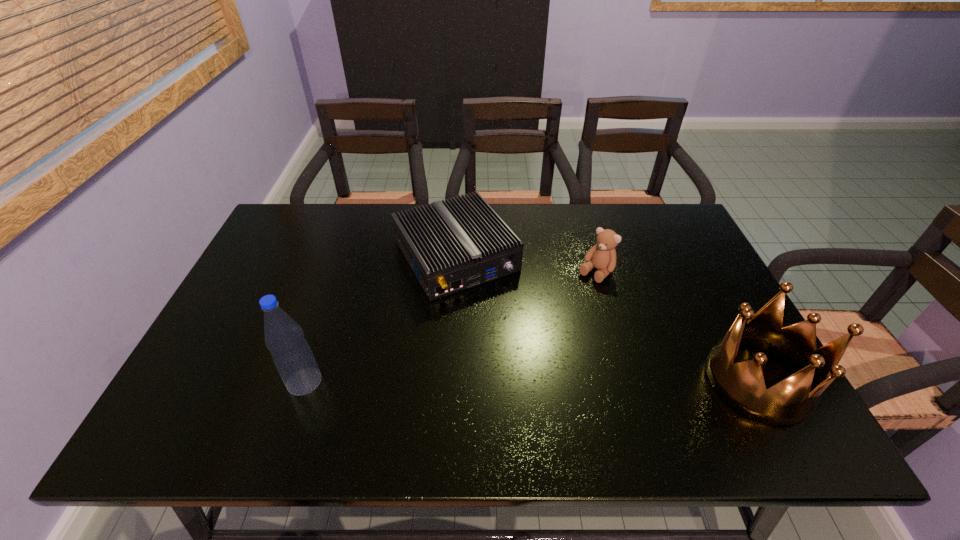
You are a GUI agent. You are given a task and a screenshot of the screen. Output one action in this format:
    pyautogui.click(x=<x>, y=<y>)
    Task: Click on the blank space located 0.160m on the face of the third tallest object
    
    Given the screenshot: What is the action you would take?
    pyautogui.click(x=556, y=315)

Find the location of a particular element. The width and height of the screenshot is (960, 540). blank space located on the face of the third tallest object is located at coordinates (524, 348).

Image resolution: width=960 pixels, height=540 pixels. In order to click on vacant space located 0.170m on the face of the third tallest object in this screenshot , I will do (554, 317).

Identify the location of free space located on the back panel of the second object from left to right. The image size is (960, 540). (504, 328).

Where is `blank space located 0.140m on the back panel of the second object from left to right`? This screenshot has height=540, width=960. blank space located 0.140m on the back panel of the second object from left to right is located at coordinates (510, 336).

I want to click on vacant area situated on the back panel of the second object from left to right, so click(540, 379).

Find the location of a particular element. The width and height of the screenshot is (960, 540). object that is at the far edge is located at coordinates (451, 246).

You are a GUI agent. You are given a task and a screenshot of the screen. Output one action in this format:
    pyautogui.click(x=<x>, y=<y>)
    Task: Click on the water bottle present at the near edge
    The width and height of the screenshot is (960, 540).
    Given the screenshot: What is the action you would take?
    pyautogui.click(x=291, y=353)

The width and height of the screenshot is (960, 540). Find the location of `crown present at the near edge`. crown present at the near edge is located at coordinates (742, 385).

Find the location of a particular element. The image size is (960, 540). object positioned at the right edge is located at coordinates (742, 385).